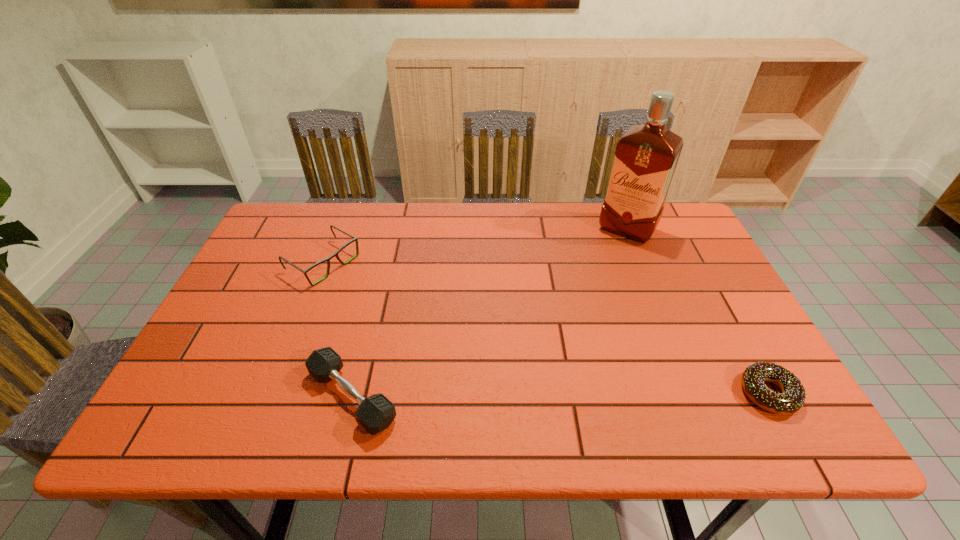
This screenshot has width=960, height=540. In order to click on liquor that is at the right edge in this screenshot , I will do `click(646, 156)`.

Where is `object at the far left corner`? object at the far left corner is located at coordinates (355, 239).

Where is `object present at the far right corner`? Image resolution: width=960 pixels, height=540 pixels. object present at the far right corner is located at coordinates (646, 156).

The height and width of the screenshot is (540, 960). Identify the location of object that is positioned at the near right corner. pyautogui.click(x=793, y=396).

Identify the location of vacant space at the far edge. The height and width of the screenshot is (540, 960). (408, 213).

This screenshot has height=540, width=960. In order to click on free region at the right edge of the desktop in this screenshot , I will do `click(701, 353)`.

The image size is (960, 540). In order to click on vacant space at the far left corner in this screenshot , I will do `click(317, 218)`.

I want to click on vacant space at the near left corner of the desktop, so click(x=223, y=366).

This screenshot has height=540, width=960. Identify the location of free spot between the spectacles and the shortest object. (546, 328).

This screenshot has width=960, height=540. Identify the location of free point between the third object from left to right and the shortest object. (698, 312).